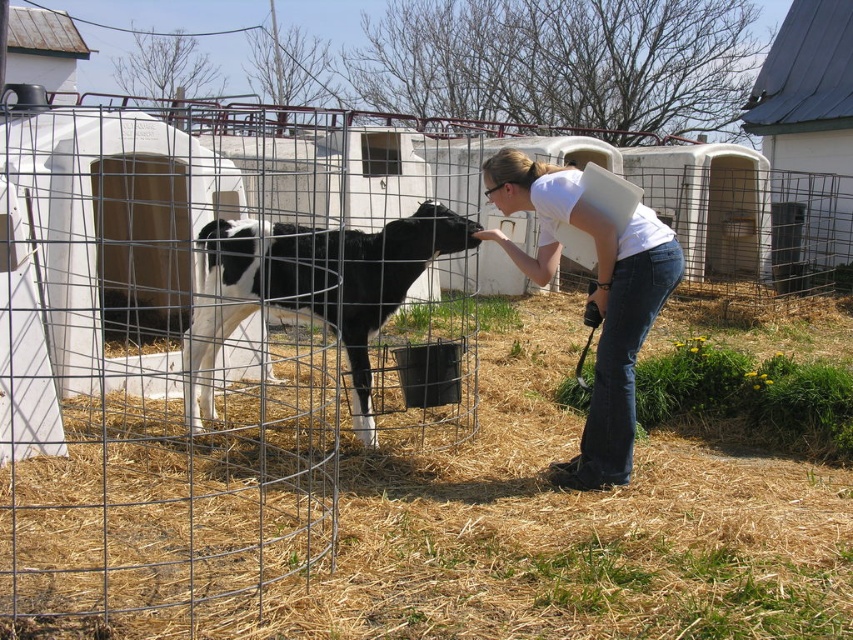
Question: Does dry straw at lower center appear on the right side of white cotton shirt at center?

Choices:
 (A) yes
 (B) no

Answer: (A)

Question: Estimate the real-world distances between objects in this image. Which object is closer to the black and white fur at center?

Choices:
 (A) white cotton shirt at center
 (B) dry straw at lower center

Answer: (A)

Question: Can you confirm if dry straw at lower center is smaller than white cotton shirt at center?

Choices:
 (A) no
 (B) yes

Answer: (A)

Question: Which point is farther to the camera?

Choices:
 (A) white cotton shirt at center
 (B) black and white fur at center

Answer: (A)

Question: Estimate the real-world distances between objects in this image. Which object is closer to the black and white fur at center?

Choices:
 (A) white cotton shirt at center
 (B) dry straw at lower center

Answer: (A)

Question: Where is dry straw at lower center located in relation to white cotton shirt at center in the image?

Choices:
 (A) left
 (B) right

Answer: (B)